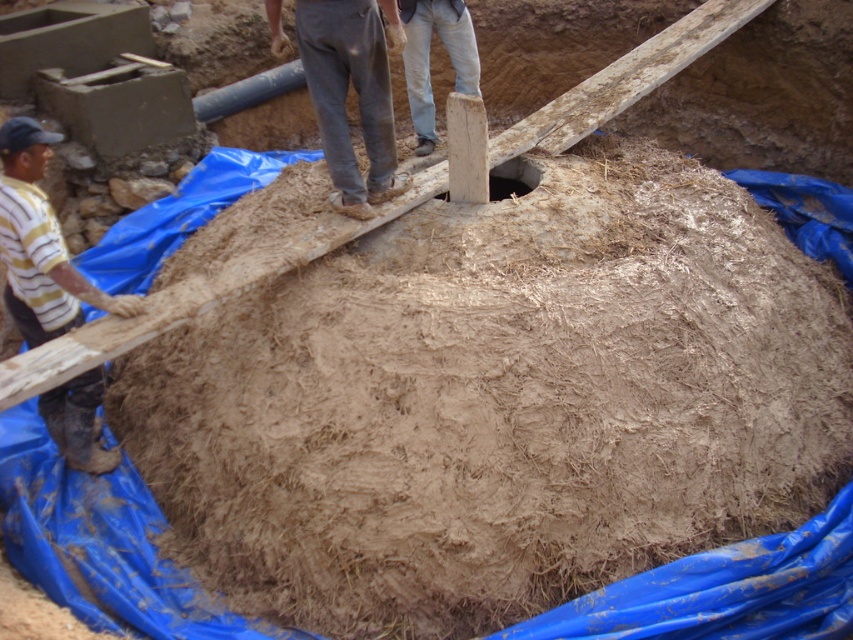
You are a construction worker who needs to move a tool from the dirty yellow shirt at left to the brown dirt hole at center. Which direction should you move the tool to place it into the hole?

The dirty yellow shirt at left is to the left of the brown dirt hole at center, so you should move the tool to the right to place it into the hole.

You are a construction worker wearing gray cotton pants at center. You need to move to the blue tarp surrounding the mound. Which direction should you walk to reach the blue tarp from your current position?

The gray cotton pants at center is located at point (x=355, y=92). Since the blue tarp surrounds the mound, you should walk outward from the center towards the perimeter to reach the blue tarp.

You are a construction worker wearing gray cotton pants at center and need to step into the brown dirt hole at center. Considering their sizes, can your pants fully cover the hole when you place them over it?

The gray cotton pants at center is bigger than brown dirt hole at center, so yes, the gray cotton pants at center can fully cover the brown dirt hole at center when placed over it.